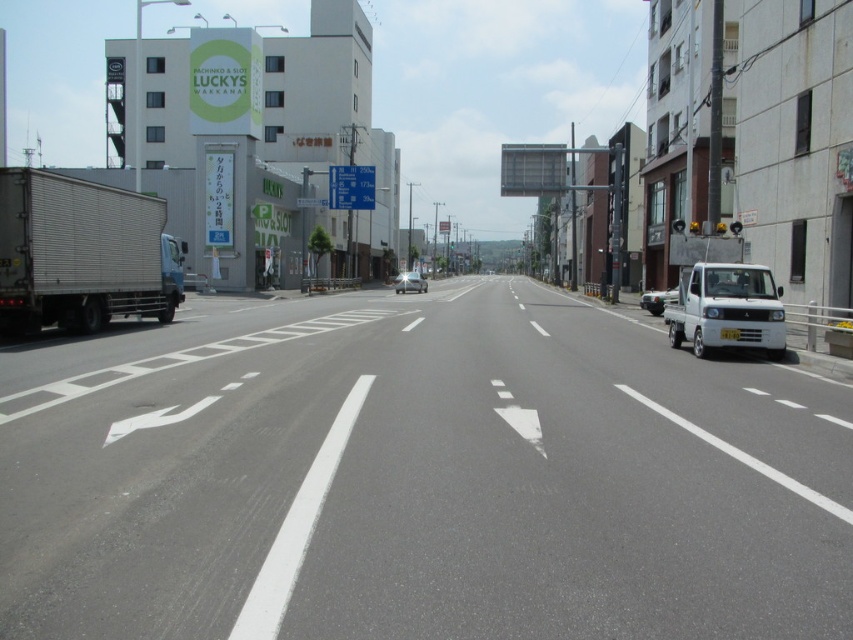
You are a delivery driver who needs to park your vehicle on the right side of the road. You see the white matte van at right and the shiny silver car at center. Which vehicle is closer to the right edge of the road?

The white matte van at right is positioned on the right side of the shiny silver car at center, so the white matte van at right is closer to the right edge of the road.

You are a delivery driver who needs to park your vehicle between the silver textured truck at left and the white matte van at right. Your vehicle is 5 meters long. Is there enough space between them to park your vehicle?

The silver textured truck at left is 18.23 meters away from the white matte van at right. Since your vehicle is 5 meters long, there is sufficient space between them to park your vehicle.